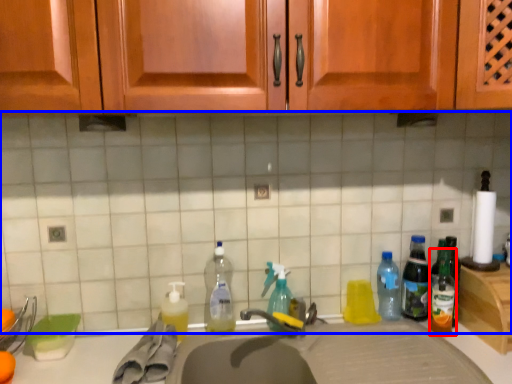
Question: Which object is further to the camera taking this photo, bottle (highlighted by a red box) or tile (highlighted by a blue box)?

Choices:
 (A) bottle
 (B) tile

Answer: (A)